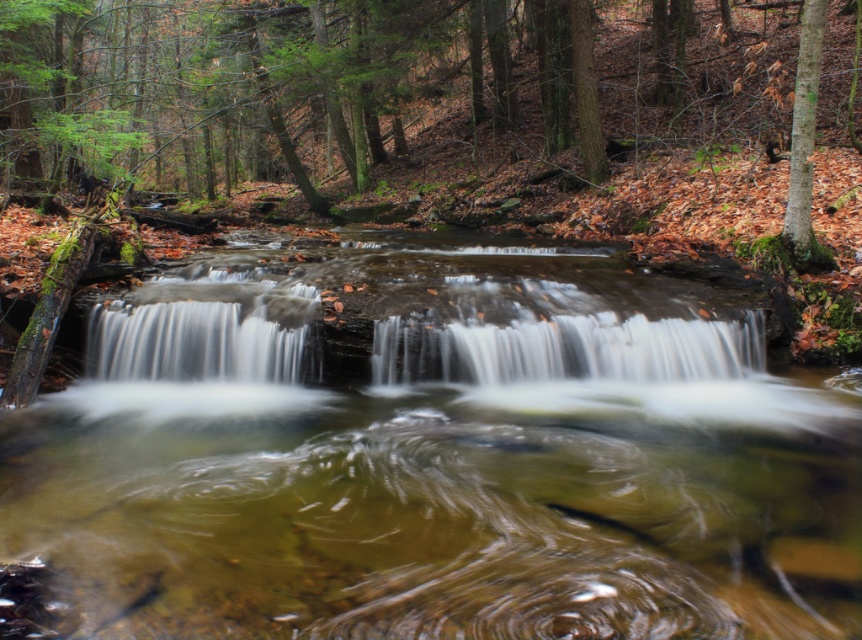
Can you confirm if translucent brown water at center is taller than white smooth waterfall at center?

No.

Does translucent brown water at center have a lesser width compared to white smooth waterfall at center?

In fact, translucent brown water at center might be wider than white smooth waterfall at center.

Is point (603, 604) behind point (142, 330)?

No.

At what (x,y) coordinates should I click in order to perform the action: click on translucent brown water at center. Please return your answer as a coordinate pair (x, y). The height and width of the screenshot is (640, 862). Looking at the image, I should click on (434, 456).

Can you confirm if white frothy water at center is shorter than green mossy bark tree at upper right?

Indeed, white frothy water at center has a lesser height compared to green mossy bark tree at upper right.

Is point (435, 380) behind point (797, 220)?

No, (435, 380) is closer to viewer.

Who is more distant from viewer, (431, 376) or (801, 227)?

The point (801, 227) is more distant.

Where is `white frothy water at center`? white frothy water at center is located at coordinates (567, 349).

Can you confirm if white frothy water at center is taller than white smooth waterfall at center?

Incorrect, white frothy water at center's height is not larger of white smooth waterfall at center's.

Does white frothy water at center lie behind white smooth waterfall at center?

That is False.

Identify the location of white frothy water at center. This screenshot has width=862, height=640. (567, 349).